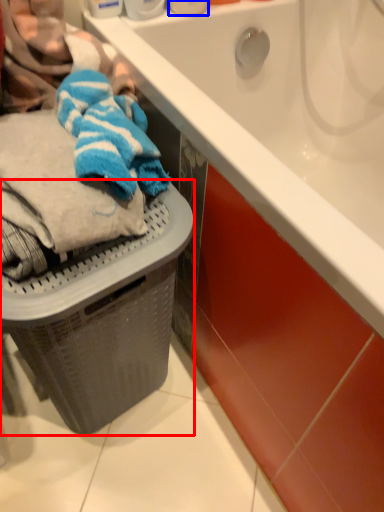
Question: Which of the following is the farthest to the observer, basket container (highlighted by a red box) or toiletry (highlighted by a blue box)?

Choices:
 (A) basket container
 (B) toiletry

Answer: (B)